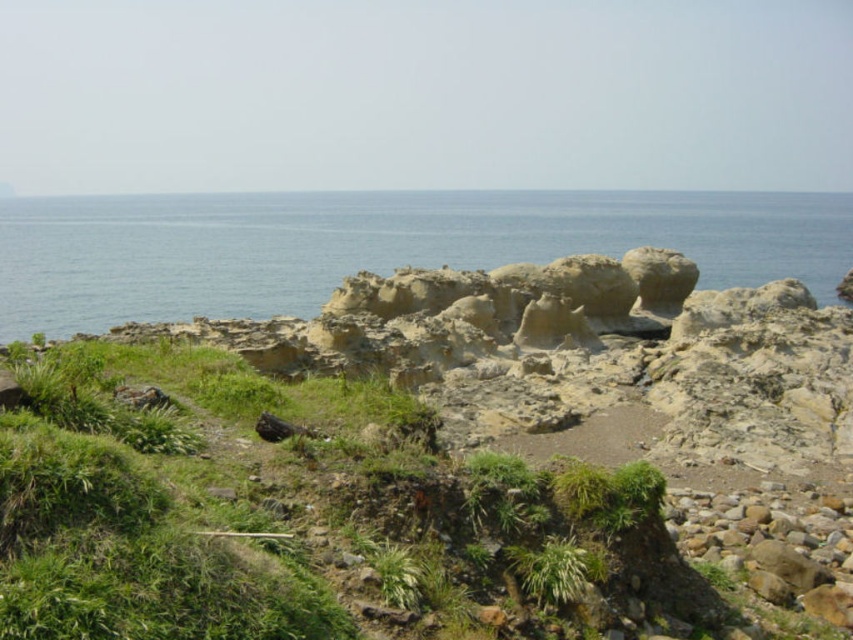
Question: Can you confirm if green grassy at center is positioned above blue water at center?

Choices:
 (A) yes
 (B) no

Answer: (B)

Question: Can you confirm if green grassy at center is positioned to the left of blue water at center?

Choices:
 (A) no
 (B) yes

Answer: (B)

Question: Can you confirm if green grassy at center is bigger than blue water at center?

Choices:
 (A) yes
 (B) no

Answer: (B)

Question: Among these points, which one is farthest from the camera?

Choices:
 (A) (730, 193)
 (B) (219, 516)

Answer: (A)